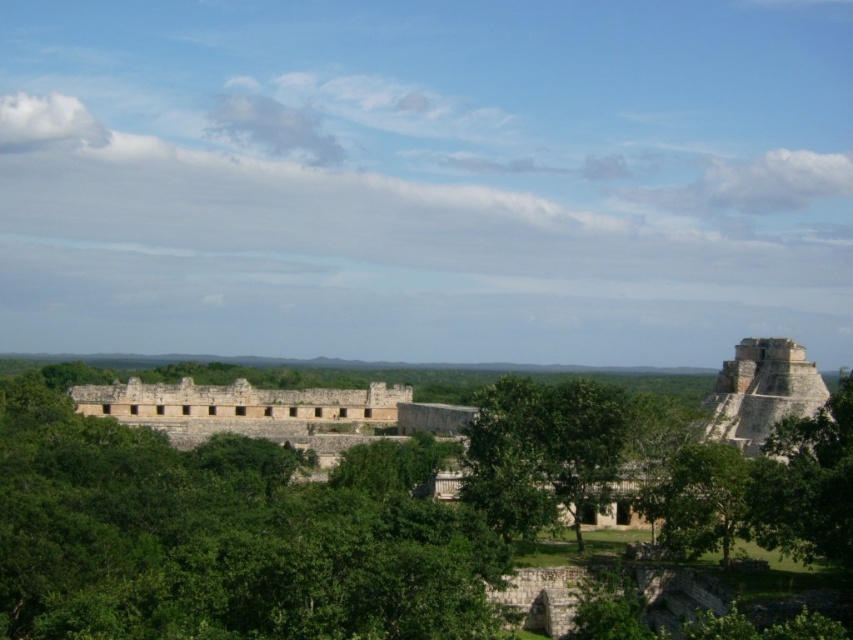
You are standing at the entrance of the Uxmal archaeological site and notice the green leafy trees at center. Based on their position, can you determine if they are closer to the main building or the pyramid in the background?

The green leafy trees at center are located at point (218, 540), which is closer to the main building in the foreground than the pyramid in the background. Therefore, they are nearer to the main building.

You are an archaeologist standing at the ancient Mayan ruins and looking at the green leafy trees at center and the green leafy tree at center. Which one is taller?

The green leafy tree at center is taller than the green leafy trees at center.